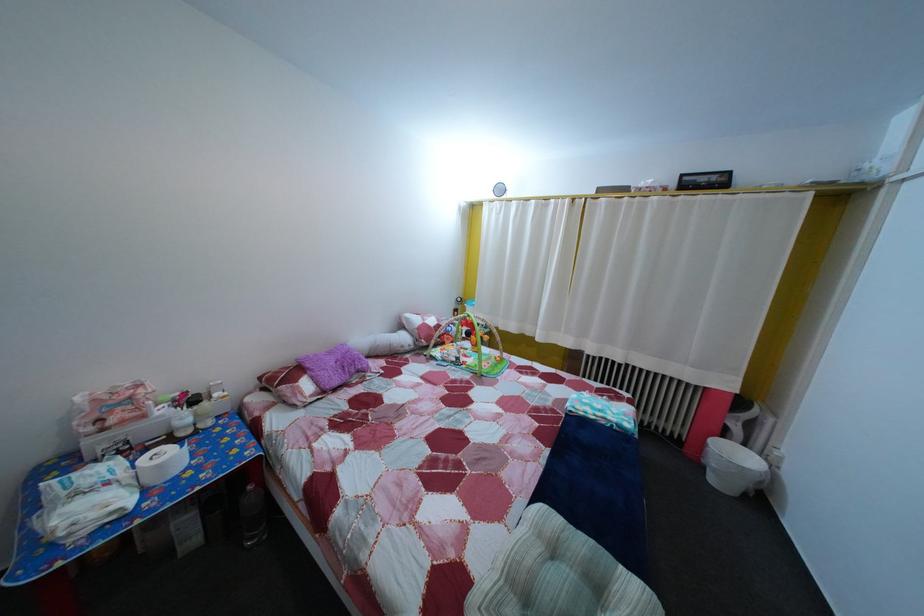
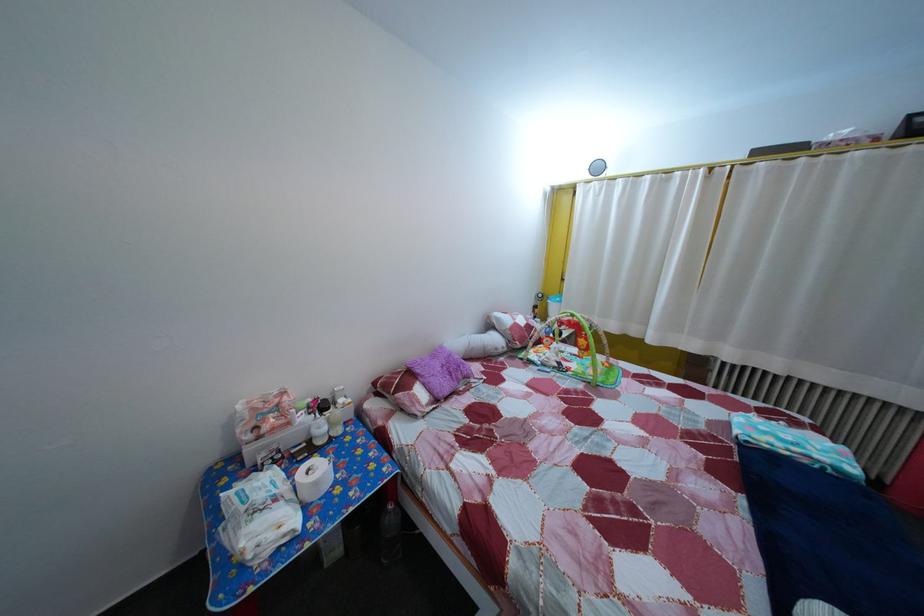
Locate, in the second image, the point that corresponds to pixel 259 496 in the first image.

(399, 515)